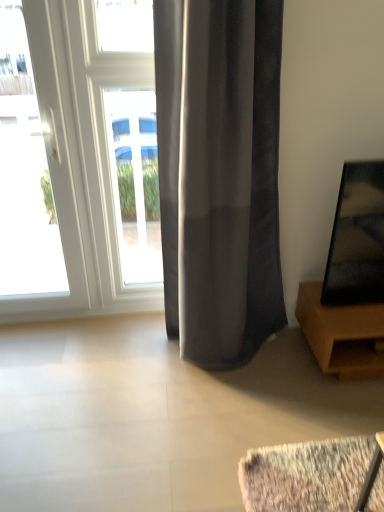
Locate an element on the screen. The height and width of the screenshot is (512, 384). free space in front of white glossy door at left is located at coordinates click(x=38, y=355).